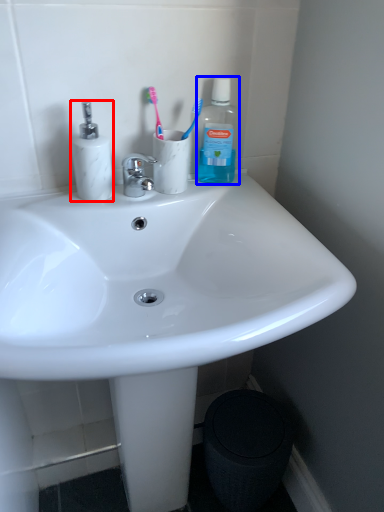
Question: Among these objects, which one is farthest to the camera, toiletries (highlighted by a red box) or bottle (highlighted by a blue box)?

Choices:
 (A) toiletries
 (B) bottle

Answer: (B)